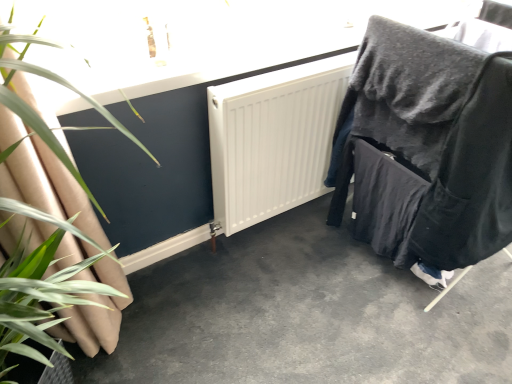
Where is `vacant point to the left of velvet black chair at right`? vacant point to the left of velvet black chair at right is located at coordinates (291, 284).